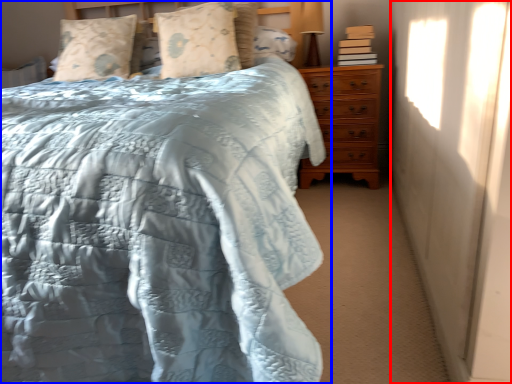
Question: Which object appears closest to the camera in this image, curtain (highlighted by a red box) or bed (highlighted by a blue box)?

Choices:
 (A) curtain
 (B) bed

Answer: (B)